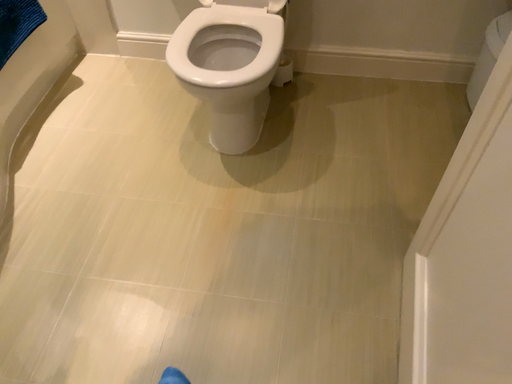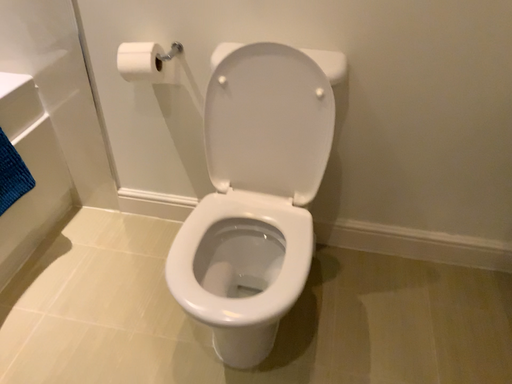
Question: Which way did the camera rotate in the video?

Choices:
 (A) rotated upward
 (B) rotated downward

Answer: (A)